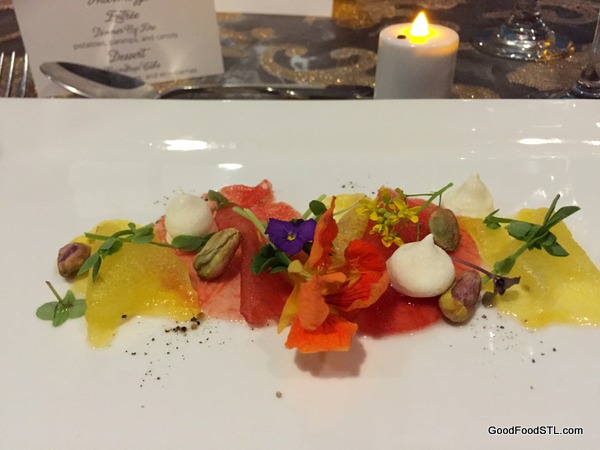
Identify the location of fork. (8, 85).